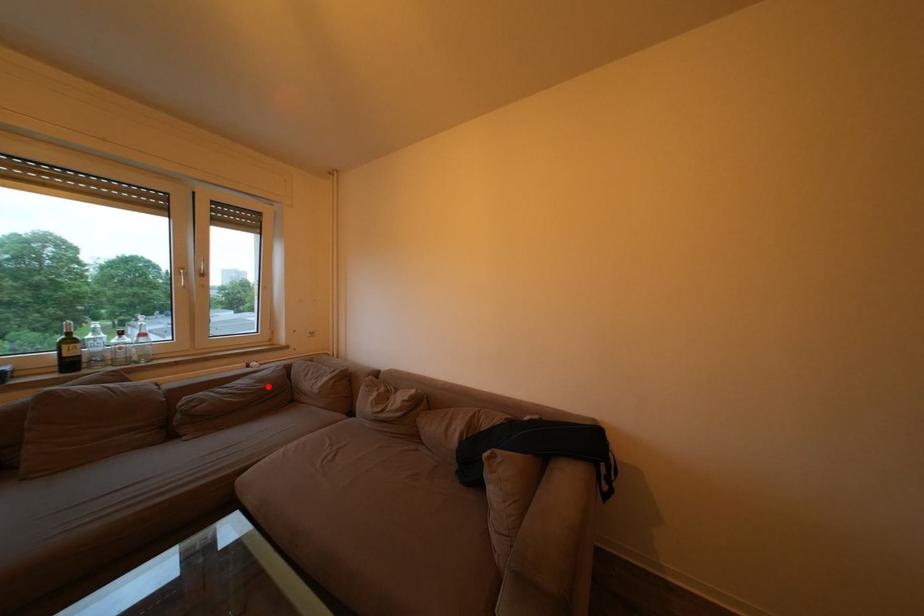
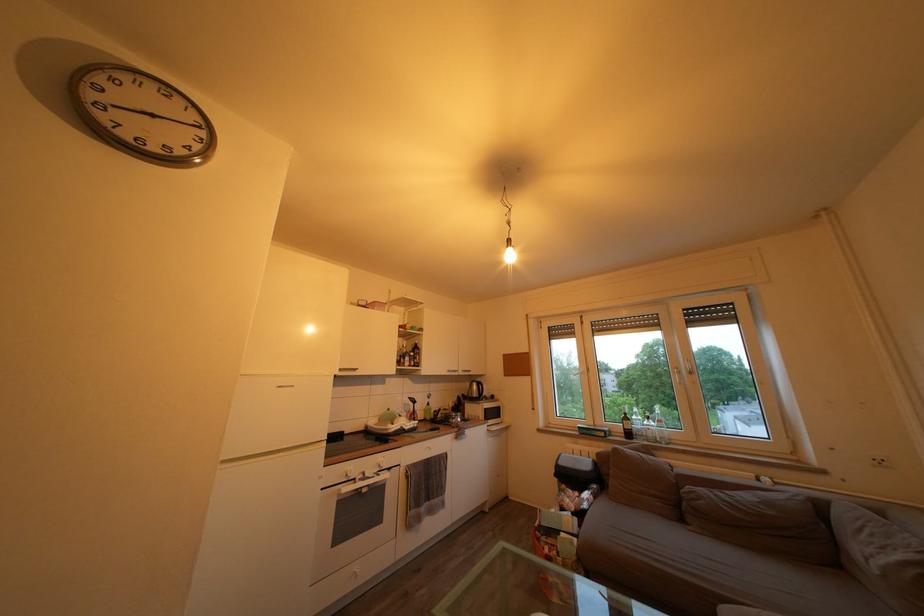
Where in the second image is the point corresponding to the highlighted location from the first image?

(774, 509)